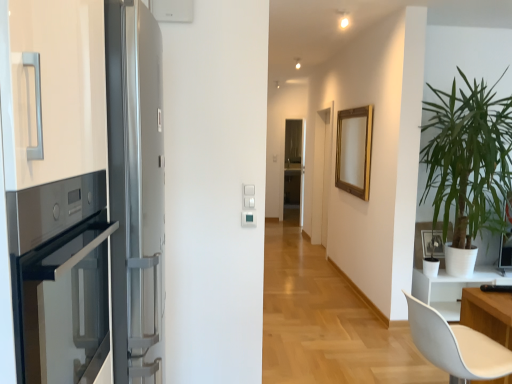
Question: Is white matte chair at lower right oriented towards transparent glass screen door at center?

Choices:
 (A) no
 (B) yes

Answer: (A)

Question: From a real-world perspective, is white matte chair at lower right on transparent glass screen door at center?

Choices:
 (A) yes
 (B) no

Answer: (B)

Question: Is white matte chair at lower right closer to camera compared to transparent glass screen door at center?

Choices:
 (A) yes
 (B) no

Answer: (A)

Question: Is white matte chair at lower right smaller than transparent glass screen door at center?

Choices:
 (A) no
 (B) yes

Answer: (A)

Question: Is white matte chair at lower right taller than transparent glass screen door at center?

Choices:
 (A) no
 (B) yes

Answer: (A)

Question: Considering the positions of transparent glass screen door at center and white matte chair at lower right in the image, is transparent glass screen door at center bigger or smaller than white matte chair at lower right?

Choices:
 (A) big
 (B) small

Answer: (B)

Question: From the image's perspective, is transparent glass screen door at center above or below white matte chair at lower right?

Choices:
 (A) below
 (B) above

Answer: (B)

Question: In the image, is transparent glass screen door at center on the left side or the right side of white matte chair at lower right?

Choices:
 (A) left
 (B) right

Answer: (B)

Question: Is transparent glass screen door at center inside the boundaries of white matte chair at lower right, or outside?

Choices:
 (A) outside
 (B) inside

Answer: (A)

Question: In terms of width, does white matte picture frame at right, the second picture frame when ordered from left to right, look wider or thinner when compared to green leafy plant at right?

Choices:
 (A) thin
 (B) wide

Answer: (A)

Question: Does point (439, 264) appear closer or farther from the camera than point (462, 79)?

Choices:
 (A) closer
 (B) farther

Answer: (B)

Question: Is white matte picture frame at right, the second picture frame viewed from the back, bigger or smaller than green leafy plant at right?

Choices:
 (A) big
 (B) small

Answer: (B)

Question: From their relative heights in the image, would you say white matte picture frame at right, which appears as the 2th picture frame when viewed from the top, is taller or shorter than green leafy plant at right?

Choices:
 (A) tall
 (B) short

Answer: (B)

Question: Is green leafy plant at right inside the boundaries of satin silver fridge at left, or outside?

Choices:
 (A) inside
 (B) outside

Answer: (B)

Question: Considering their positions, is green leafy plant at right located in front of or behind satin silver fridge at left?

Choices:
 (A) behind
 (B) front

Answer: (A)